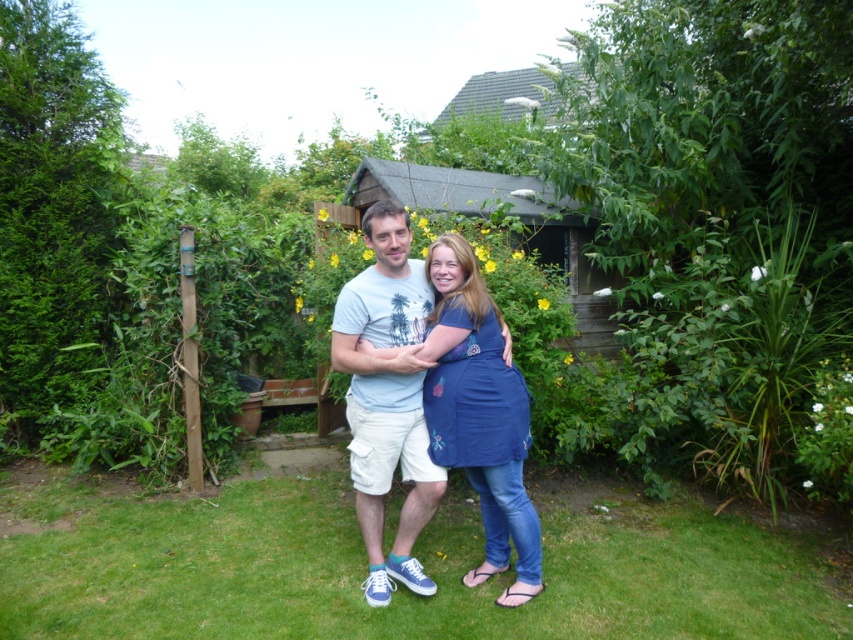
Who is taller, white cotton t-shirt at center or blue cotton apron at center?

white cotton t-shirt at center is taller.

Does white cotton t-shirt at center have a lesser height compared to blue cotton apron at center?

In fact, white cotton t-shirt at center may be taller than blue cotton apron at center.

Is point (381, 291) more distant than point (448, 419)?

Yes, point (381, 291) is behind point (448, 419).

Identify the location of white cotton t-shirt at center. This screenshot has height=640, width=853. (x=387, y=397).

Between white cotton t-shirt at center and blue denim jeans at center, which one is positioned lower?

blue denim jeans at center is below.

Is point (386, 442) behind point (454, 460)?

Yes, it is behind point (454, 460).

Locate an element on the screen. white cotton t-shirt at center is located at coordinates (387, 397).

Locate an element on the screen. The height and width of the screenshot is (640, 853). white cotton t-shirt at center is located at coordinates (387, 397).

Does point (496, 460) lie behind point (490, 376)?

No, (496, 460) is closer to viewer.

Between point (514, 388) and point (450, 307), which one is positioned behind?

Positioned behind is point (514, 388).

Where is `blue denim jeans at center`? This screenshot has width=853, height=640. blue denim jeans at center is located at coordinates (479, 412).

Locate an element on the screen. The image size is (853, 640). blue denim jeans at center is located at coordinates (479, 412).